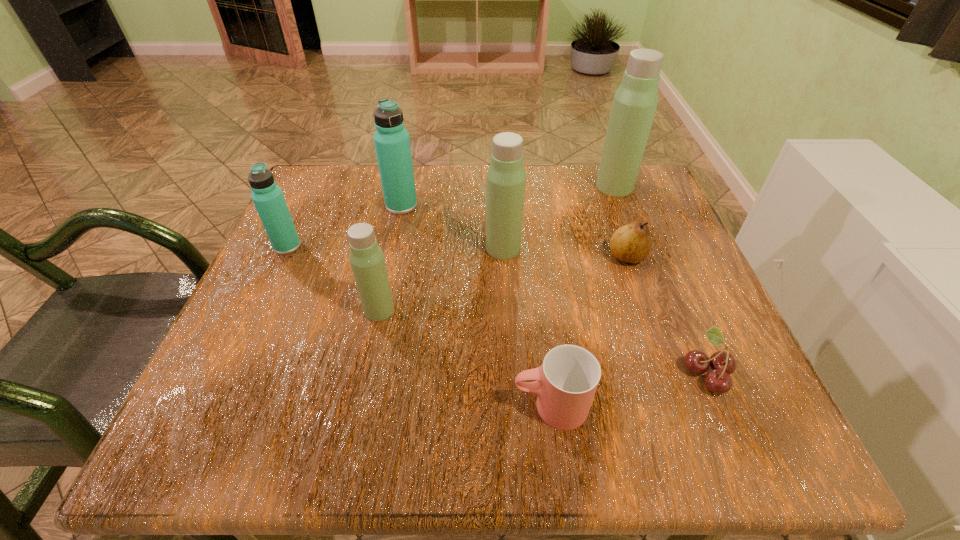
Find the location of a particular element. This screenshot has width=960, height=540. vacant region at the far right corner of the desktop is located at coordinates (644, 198).

Where is `free point between the cup and the sixth farthest object`? free point between the cup and the sixth farthest object is located at coordinates (465, 358).

Find the location of a particular element. free spot between the red cherry and the cup is located at coordinates (629, 389).

Where is `free space between the rightmost thermos bottle and the nearer aqua thermos bottle`? This screenshot has height=540, width=960. free space between the rightmost thermos bottle and the nearer aqua thermos bottle is located at coordinates (451, 216).

Locate an element on the screen. The image size is (960, 540). vacant point located between the leftmost object and the second biggest light thermos bottle is located at coordinates (396, 247).

Identify the location of blank region between the cup and the farther aqua thermos bottle. Image resolution: width=960 pixels, height=540 pixels. [x=476, y=306].

The width and height of the screenshot is (960, 540). Find the location of `vacant space that's between the cherry and the nearest thermos bottle`. vacant space that's between the cherry and the nearest thermos bottle is located at coordinates (543, 341).

Locate an element on the screen. free space that is in between the brown pear and the nearest thermos bottle is located at coordinates (503, 284).

You are a GUI agent. You are given a task and a screenshot of the screen. Output one action in this format:
    pyautogui.click(x=<x>, y=<y>)
    Task: Click on the vacant point located between the cup and the bigger aqua thermos bottle
    
    Given the screenshot: What is the action you would take?
    pyautogui.click(x=476, y=306)

Locate an element on the screen. This screenshot has width=960, height=540. object that is the third closest to the brown pear is located at coordinates (718, 380).